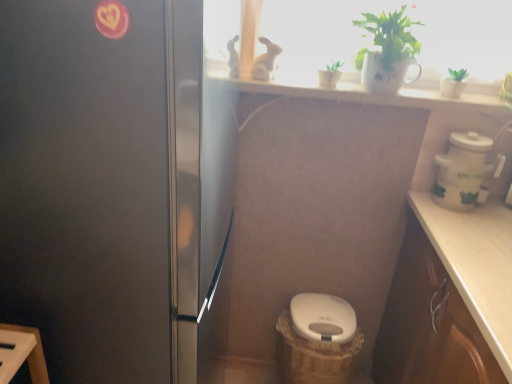
Question: From the image's perspective, would you say white glossy toilet bowl at center is shown under green matte plant at upper center, acting as the first houseplant starting from the left?

Choices:
 (A) no
 (B) yes

Answer: (B)

Question: Is green matte plant at upper center, acting as the first houseplant starting from the left, completely or partially inside white glossy toilet bowl at center?

Choices:
 (A) yes
 (B) no

Answer: (B)

Question: Does white glossy toilet bowl at center have a greater height compared to green matte plant at upper center, acting as the first houseplant starting from the left?

Choices:
 (A) yes
 (B) no

Answer: (B)

Question: Are white glossy toilet bowl at center and green matte plant at upper center, acting as the first houseplant starting from the left, located far from each other?

Choices:
 (A) yes
 (B) no

Answer: (B)

Question: From the image's perspective, would you say white glossy toilet bowl at center is positioned over green matte plant at upper center, acting as the first houseplant starting from the left?

Choices:
 (A) no
 (B) yes

Answer: (A)

Question: From the image's perspective, is brown woven basket at lower center above or below white glossy toilet bowl at center?

Choices:
 (A) above
 (B) below

Answer: (B)

Question: Considering the positions of brown woven basket at lower center and white glossy toilet bowl at center in the image, is brown woven basket at lower center wider or thinner than white glossy toilet bowl at center?

Choices:
 (A) thin
 (B) wide

Answer: (A)

Question: Considering the positions of point (339, 347) and point (330, 337), is point (339, 347) closer or farther from the camera than point (330, 337)?

Choices:
 (A) closer
 (B) farther

Answer: (A)

Question: Based on their positions, is brown woven basket at lower center located to the left or right of white glossy toilet bowl at center?

Choices:
 (A) right
 (B) left

Answer: (B)

Question: In terms of height, does green matte plant at upper center, the third houseplant in the right-to-left sequence, look taller or shorter compared to white ceramic mug at upper center, marked as the 2th houseplant in a right-to-left arrangement?

Choices:
 (A) tall
 (B) short

Answer: (B)

Question: Considering their positions, is green matte plant at upper center, the third houseplant in the right-to-left sequence, located in front of or behind white ceramic mug at upper center, which ranks as the second houseplant in left-to-right order?

Choices:
 (A) behind
 (B) front

Answer: (A)

Question: Is point (321, 72) positioned closer to the camera than point (404, 61)?

Choices:
 (A) closer
 (B) farther

Answer: (B)

Question: Is green matte plant at upper center, acting as the first houseplant starting from the left, to the left or to the right of white ceramic mug at upper center, marked as the 2th houseplant in a right-to-left arrangement, in the image?

Choices:
 (A) left
 (B) right

Answer: (A)

Question: From a real-world perspective, is green matte plant at upper right, positioned as the first houseplant in right-to-left order, physically located above or below white ceramic pot at right?

Choices:
 (A) below
 (B) above

Answer: (B)

Question: Considering the positions of green matte plant at upper right, which is the third houseplant in left-to-right order, and white ceramic pot at right in the image, is green matte plant at upper right, which is the third houseplant in left-to-right order, taller or shorter than white ceramic pot at right?

Choices:
 (A) short
 (B) tall

Answer: (A)